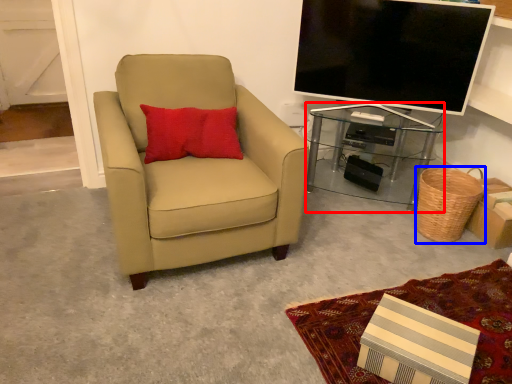
Question: Which object appears closest to the camera in this image, desk (highlighted by a red box) or basket (highlighted by a blue box)?

Choices:
 (A) desk
 (B) basket

Answer: (B)